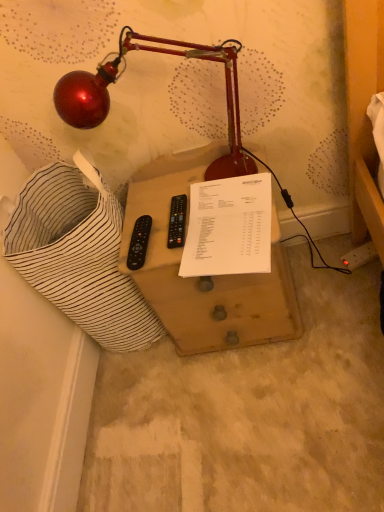
What do you see at coordinates (207, 277) in the screenshot? I see `wooden drawer at center` at bounding box center [207, 277].

What do you see at coordinates (177, 221) in the screenshot?
I see `black plastic remote at center, acting as the second control starting from the left` at bounding box center [177, 221].

Image resolution: width=384 pixels, height=512 pixels. Identify the location of white paper at center. (229, 227).

Who is taller, metallic red lamp at upper left or black plastic remote at center, marked as the 1th control in a right-to-left arrangement?

metallic red lamp at upper left is taller.

Can we say metallic red lamp at upper left lies outside black plastic remote at center, marked as the 1th control in a right-to-left arrangement?

metallic red lamp at upper left is positioned outside black plastic remote at center, marked as the 1th control in a right-to-left arrangement.

From the image's perspective, relative to black plastic remote at center, marked as the 1th control in a right-to-left arrangement, is metallic red lamp at upper left above or below?

From the image's perspective, metallic red lamp at upper left appears above black plastic remote at center, marked as the 1th control in a right-to-left arrangement.

From a real-world perspective, is white paper at center on top of black plastic remote at center, acting as the second control starting from the left?

No, from a real-world perspective, white paper at center is not above black plastic remote at center, acting as the second control starting from the left.

This screenshot has width=384, height=512. What are the coordinates of `document lying below the black plastic remote at center, acting as the second control starting from the left (from the image's perspective)` in the screenshot? It's located at (229, 227).

Is white paper at center spatially inside black plastic remote at center, marked as the 1th control in a right-to-left arrangement, or outside of it?

white paper at center is not enclosed by black plastic remote at center, marked as the 1th control in a right-to-left arrangement.

Considering the sizes of objects white paper at center and black plastic remote at center-left, the first control in the left-to-right sequence, in the image provided, who is shorter, white paper at center or black plastic remote at center-left, the first control in the left-to-right sequence,?

Standing shorter between the two is black plastic remote at center-left, the first control in the left-to-right sequence.

Considering the relative sizes of white paper at center and black plastic remote at center-left, the first control in the left-to-right sequence, in the image provided, is white paper at center thinner than black plastic remote at center-left, the first control in the left-to-right sequence,?

No, white paper at center is not thinner than black plastic remote at center-left, the first control in the left-to-right sequence.

Is white paper at center inside or outside of black plastic remote at center-left, the first control in the left-to-right sequence?

white paper at center is not enclosed by black plastic remote at center-left, the first control in the left-to-right sequence.

Considering the points (145, 224) and (56, 85), which point is in front, point (145, 224) or point (56, 85)?

The point (56, 85) is in front.

Is black plastic remote at center-left, arranged as the second control when viewed from the right, shorter than metallic red lamp at upper left?

Yes, black plastic remote at center-left, arranged as the second control when viewed from the right, is shorter than metallic red lamp at upper left.

Can you confirm if black plastic remote at center-left, the first control in the left-to-right sequence, is positioned to the left of metallic red lamp at upper left?

Indeed, black plastic remote at center-left, the first control in the left-to-right sequence, is positioned on the left side of metallic red lamp at upper left.

Does black plastic remote at center-left, the first control in the left-to-right sequence, touch metallic red lamp at upper left?

black plastic remote at center-left, the first control in the left-to-right sequence, is not next to metallic red lamp at upper left, and they're not touching.

From a real-world perspective, is black plastic remote at center-left, arranged as the second control when viewed from the right, over black plastic remote at center, acting as the second control starting from the left?

Yes, from a real-world perspective, black plastic remote at center-left, arranged as the second control when viewed from the right, is over black plastic remote at center, acting as the second control starting from the left

From the image's perspective, would you say black plastic remote at center-left, arranged as the second control when viewed from the right, is positioned over black plastic remote at center, marked as the 1th control in a right-to-left arrangement?

Actually, black plastic remote at center-left, arranged as the second control when viewed from the right, appears below black plastic remote at center, marked as the 1th control in a right-to-left arrangement, in the image.

Can you see black plastic remote at center-left, the first control in the left-to-right sequence, touching black plastic remote at center, marked as the 1th control in a right-to-left arrangement?

Yes.

Considering the relative sizes of black plastic remote at center-left, the first control in the left-to-right sequence, and black plastic remote at center, acting as the second control starting from the left, in the image provided, is black plastic remote at center-left, the first control in the left-to-right sequence, bigger than black plastic remote at center, acting as the second control starting from the left,?

Indeed, black plastic remote at center-left, the first control in the left-to-right sequence, has a larger size compared to black plastic remote at center, acting as the second control starting from the left.

In the scene shown: Are wooden drawer at center and white paper at center far apart?

No.

Is wooden drawer at center closer to camera compared to white paper at center?

No, the depth of wooden drawer at center is greater than that of white paper at center.

Which is correct: wooden drawer at center is inside white paper at center, or outside of it?

wooden drawer at center cannot be found inside white paper at center.

Considering the sizes of objects wooden drawer at center and white paper at center in the image provided, who is thinner, wooden drawer at center or white paper at center?

Thinner between the two is white paper at center.

Can you confirm if wooden drawer at center is smaller than black plastic remote at center-left, arranged as the second control when viewed from the right?

No, wooden drawer at center is not smaller than black plastic remote at center-left, arranged as the second control when viewed from the right.

Is wooden drawer at center situated inside black plastic remote at center-left, the first control in the left-to-right sequence, or outside?

wooden drawer at center is not enclosed by black plastic remote at center-left, the first control in the left-to-right sequence.

Are wooden drawer at center and black plastic remote at center-left, arranged as the second control when viewed from the right, beside each other?

No, wooden drawer at center is not beside black plastic remote at center-left, arranged as the second control when viewed from the right.

Where is `control that is on the right side of metallic red lamp at upper left`? The width and height of the screenshot is (384, 512). control that is on the right side of metallic red lamp at upper left is located at coordinates (177, 221).

Identify the location of document that is under the black plastic remote at center, acting as the second control starting from the left (from a real-world perspective). The width and height of the screenshot is (384, 512). (229, 227).

Looking at the image, which one is located further to black plastic remote at center-left, arranged as the second control when viewed from the right, white paper at center or black plastic remote at center, marked as the 1th control in a right-to-left arrangement?

white paper at center is positioned further to the anchor black plastic remote at center-left, arranged as the second control when viewed from the right.

Considering their positions, is metallic red lamp at upper left positioned further to wooden drawer at center than white paper at center?

metallic red lamp at upper left is positioned further to the anchor wooden drawer at center.

From the image, which object appears to be farther from metallic red lamp at upper left, white paper at center or wooden drawer at center?

wooden drawer at center is positioned further to the anchor metallic red lamp at upper left.

Considering their positions, is wooden drawer at center positioned closer to white paper at center than metallic red lamp at upper left?

wooden drawer at center is closer to white paper at center.

Based on their spatial positions, is black plastic remote at center-left, the first control in the left-to-right sequence, or white paper at center closer to black plastic remote at center, marked as the 1th control in a right-to-left arrangement?

black plastic remote at center-left, the first control in the left-to-right sequence, is closer to black plastic remote at center, marked as the 1th control in a right-to-left arrangement.

Considering their positions, is black plastic remote at center, acting as the second control starting from the left, positioned closer to white paper at center than metallic red lamp at upper left?

Based on the image, black plastic remote at center, acting as the second control starting from the left, appears to be nearer to white paper at center.

Estimate the real-world distances between objects in this image. Which object is closer to metallic red lamp at upper left, wooden drawer at center or black plastic remote at center, acting as the second control starting from the left?

The object closer to metallic red lamp at upper left is black plastic remote at center, acting as the second control starting from the left.

From the image, which object appears to be nearer to wooden drawer at center, black plastic remote at center-left, the first control in the left-to-right sequence, or black plastic remote at center, acting as the second control starting from the left?

Based on the image, black plastic remote at center, acting as the second control starting from the left, appears to be nearer to wooden drawer at center.

Locate an element on the screen. The height and width of the screenshot is (512, 384). control between black plastic remote at center-left, arranged as the second control when viewed from the right, and wooden drawer at center is located at coordinates (177, 221).

The image size is (384, 512). In order to click on document between metallic red lamp at upper left and wooden drawer at center vertically in this screenshot , I will do `click(229, 227)`.

Where is `control between metallic red lamp at upper left and black plastic remote at center-left, arranged as the second control when viewed from the right, vertically`? This screenshot has width=384, height=512. control between metallic red lamp at upper left and black plastic remote at center-left, arranged as the second control when viewed from the right, vertically is located at coordinates (177, 221).

Find the location of a particular element. The image size is (384, 512). furniture located between black plastic remote at center-left, arranged as the second control when viewed from the right, and white paper at center in the left-right direction is located at coordinates (x=207, y=277).